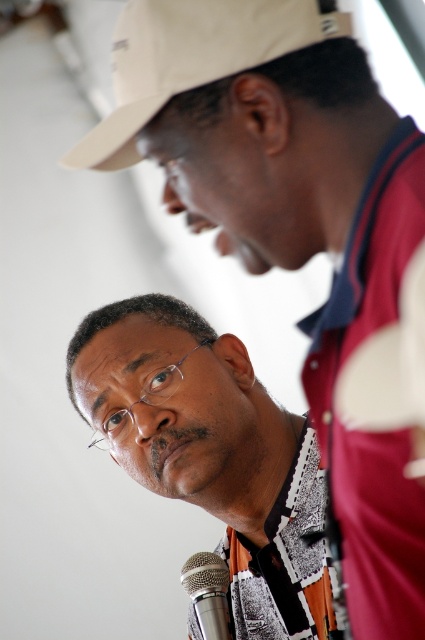
Question: Which point is farther from the camera taking this photo?

Choices:
 (A) (223, 593)
 (B) (291, 38)

Answer: (A)

Question: Does beige fabric cap at upper center appear on the right side of silver metallic microphone at lower center?

Choices:
 (A) yes
 (B) no

Answer: (B)

Question: Is white textured shirt at center further to camera compared to silver metallic microphone at lower center?

Choices:
 (A) yes
 (B) no

Answer: (B)

Question: Observing the image, what is the correct spatial positioning of beige fabric cap at upper center in reference to silver metallic microphone at lower center?

Choices:
 (A) right
 (B) left

Answer: (B)

Question: Which object is closer to the camera taking this photo?

Choices:
 (A) beige fabric cap at upper center
 (B) silver metallic microphone at lower center
 (C) white textured shirt at center

Answer: (A)

Question: Which point is closer to the camera?

Choices:
 (A) white textured shirt at center
 (B) beige fabric cap at upper center

Answer: (B)